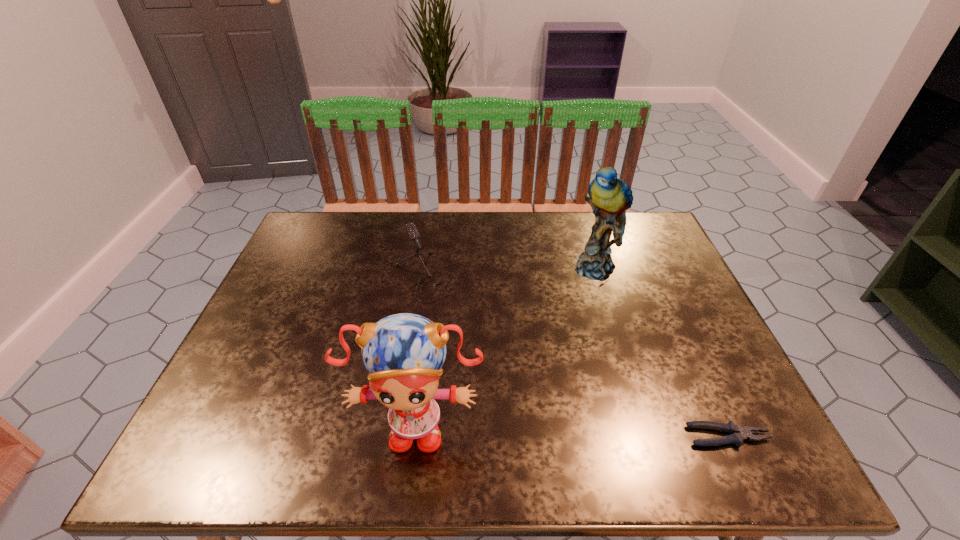
Locate an element on the screen. free point located 0.170m on the stand of the microphone is located at coordinates (480, 339).

You are a GUI agent. You are given a task and a screenshot of the screen. Output one action in this format:
    pyautogui.click(x=<x>, y=<y>)
    Task: Click on the vacant space located 0.250m on the stand of the microphone
    This screenshot has height=540, width=960.
    Given the screenshot: What is the action you would take?
    pyautogui.click(x=499, y=361)

Locate an element on the screen. parrot positioned at the far edge is located at coordinates (610, 197).

Find the location of `microphone that is at the far edge`. microphone that is at the far edge is located at coordinates (411, 229).

Where is `doll that is at the near edge`? doll that is at the near edge is located at coordinates [404, 353].

The width and height of the screenshot is (960, 540). What are the coordinates of `pliers located at the near edge` in the screenshot? It's located at (738, 434).

Locate an element on the screen. pliers positioned at the right edge is located at coordinates (738, 434).

This screenshot has height=540, width=960. In order to click on parrot at the right edge in this screenshot , I will do `click(610, 197)`.

Image resolution: width=960 pixels, height=540 pixels. I want to click on object at the far right corner, so click(x=610, y=197).

Image resolution: width=960 pixels, height=540 pixels. Find the location of `object that is at the near right corner`. object that is at the near right corner is located at coordinates (738, 434).